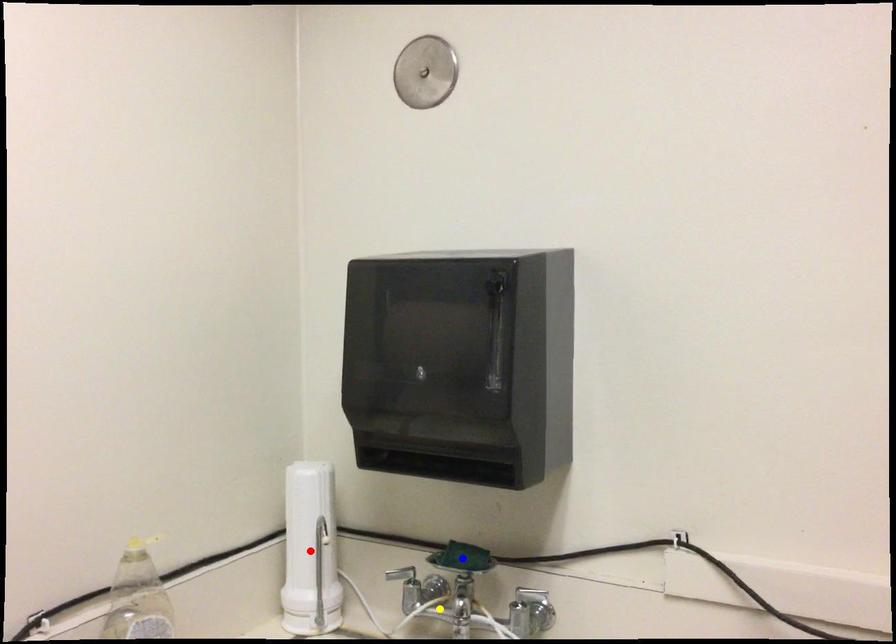
Order these from nearest to farthest:
blue point | red point | yellow point

1. blue point
2. yellow point
3. red point